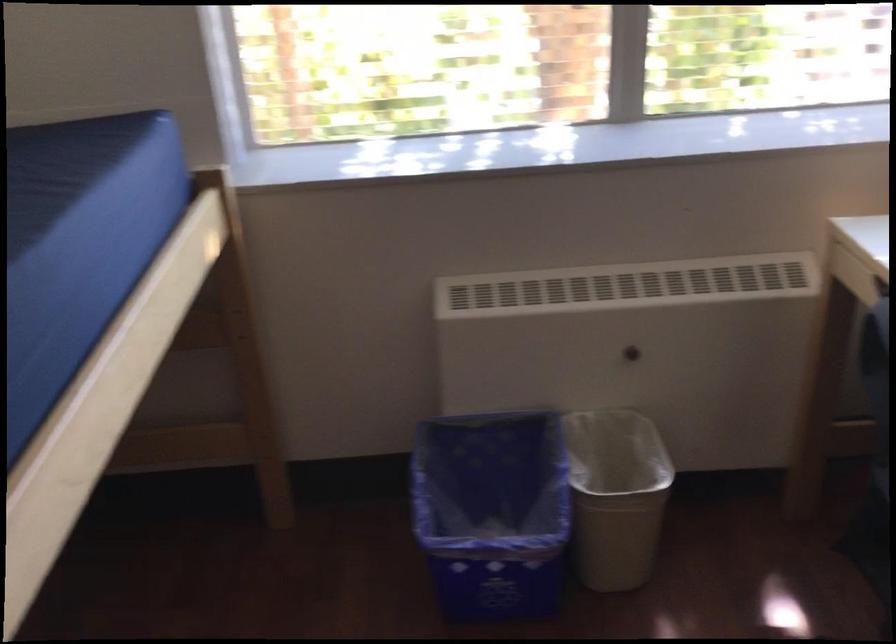
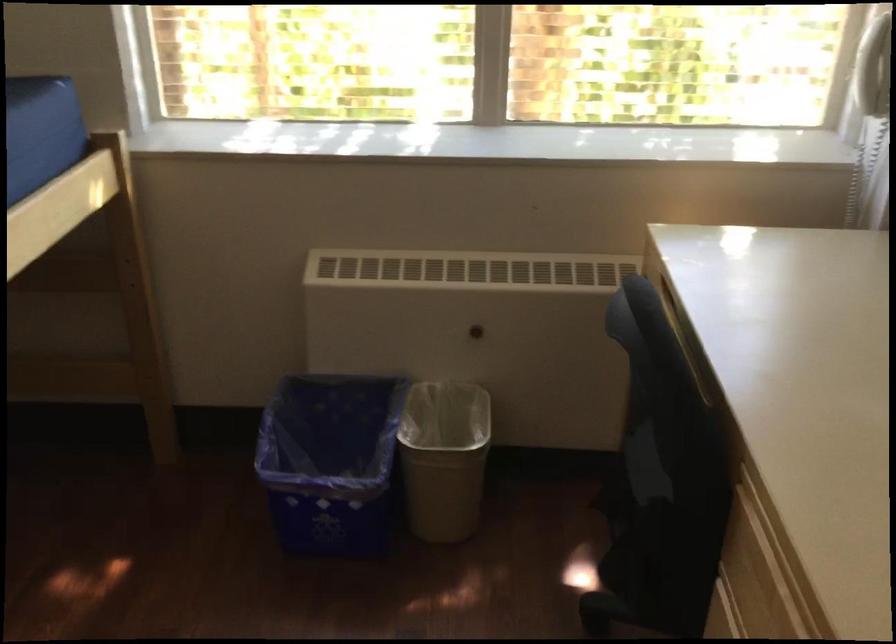
In the second image, find the point that corresponds to pixel 472 509 in the first image.

(330, 462)